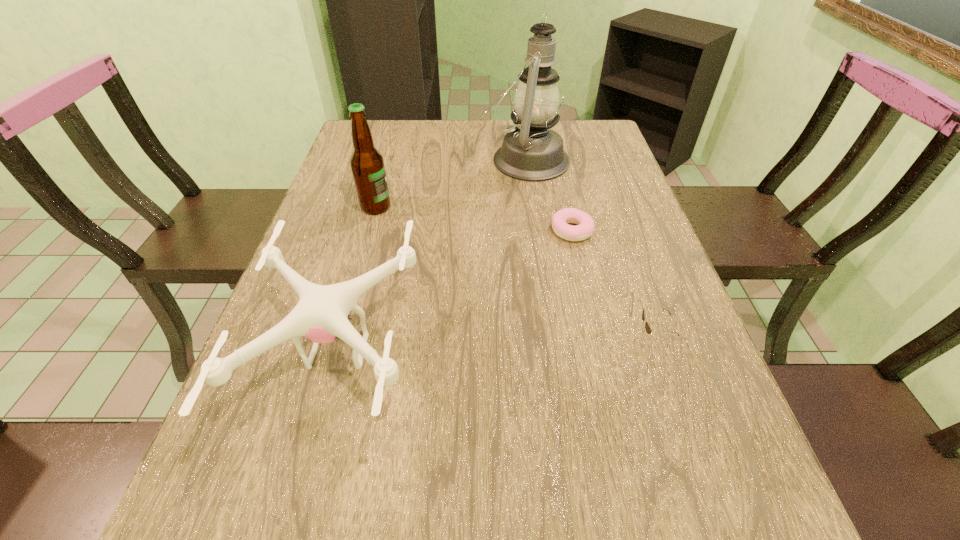
I want to click on sunglasses located in the right edge section of the desktop, so click(x=648, y=329).

This screenshot has width=960, height=540. I want to click on pastry that is at the right edge, so click(x=585, y=226).

Locate an element on the screen. The image size is (960, 540). object that is at the far right corner is located at coordinates (531, 151).

Locate an element on the screen. This screenshot has height=540, width=960. free region at the left edge of the desktop is located at coordinates (309, 476).

The width and height of the screenshot is (960, 540). In the image, there is a desktop. In order to click on free space at the right edge in this screenshot , I will do `click(601, 191)`.

Image resolution: width=960 pixels, height=540 pixels. What are the coordinates of `free region at the far left corner of the desktop` in the screenshot? It's located at (382, 122).

You are a GUI agent. You are given a task and a screenshot of the screen. Output one action in this format:
    pyautogui.click(x=<x>, y=<y>)
    Task: Click on the empty location between the second tallest object and the shortest object
    
    Given the screenshot: What is the action you would take?
    pyautogui.click(x=474, y=219)

This screenshot has height=540, width=960. I want to click on free space between the drone and the tallest object, so click(x=432, y=255).

This screenshot has width=960, height=540. What are the coordinates of `vacant space in between the third farthest object and the third tallest object` in the screenshot? It's located at (455, 291).

Identify the location of vacant point located between the shortest object and the farthest object. (548, 195).